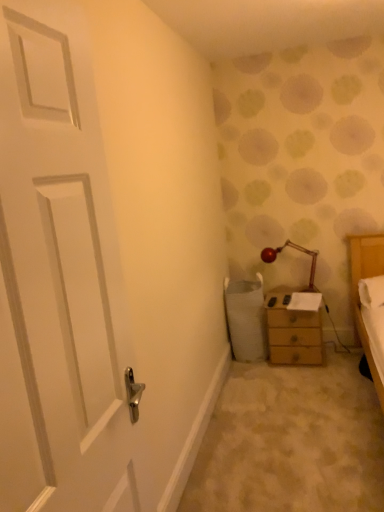
Question: Is point (130, 465) positioned closer to the camera than point (279, 298)?

Choices:
 (A) closer
 (B) farther

Answer: (A)

Question: Considering the positions of white matte door at left and wooden chest of drawers at right in the image, is white matte door at left wider or thinner than wooden chest of drawers at right?

Choices:
 (A) thin
 (B) wide

Answer: (A)

Question: Estimate the real-world distances between objects in this image. Which object is closer to the matte red lamp at upper right?

Choices:
 (A) wooden chest of drawers at right
 (B) white matte door at left

Answer: (A)

Question: Considering the real-world distances, which object is closest to the white matte door at left?

Choices:
 (A) wooden chest of drawers at right
 (B) matte red lamp at upper right

Answer: (A)